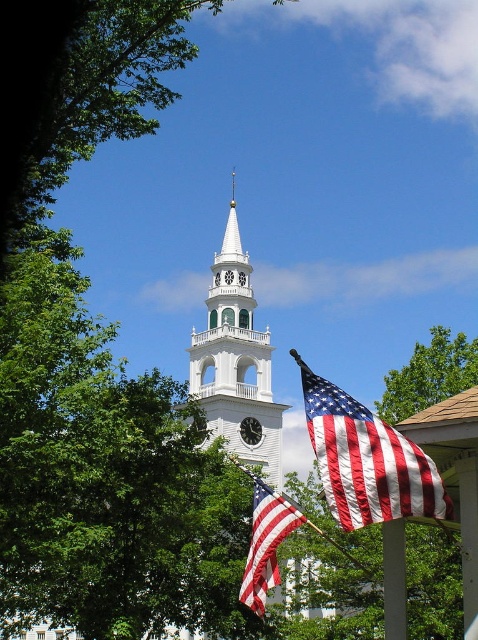
Is point (258, 356) positioned before point (260, 432)?

No, (258, 356) is behind (260, 432).

Between white wooden steeple at center and black metal clock at center, which one appears on the left side from the viewer's perspective?

Positioned to the left is white wooden steeple at center.

Image resolution: width=478 pixels, height=640 pixels. What do you see at coordinates (236, 358) in the screenshot?
I see `white wooden steeple at center` at bounding box center [236, 358].

The image size is (478, 640). Identify the location of white wooden steeple at center. (236, 358).

Based on the photo, is green leafy tree at lower right closer to camera compared to metallic flag pole at lower center?

No.

Does point (442, 378) lie in front of point (273, 552)?

No, it is not.

I want to click on green leafy tree at lower right, so click(x=428, y=374).

Is point (271, 540) less distant than point (249, 424)?

Yes, point (271, 540) is in front of point (249, 424).

Does american flag at lower center appear over black metal clock at center?

Actually, american flag at lower center is below black metal clock at center.

Is point (283, 504) in front of point (250, 422)?

Yes, it is.

I want to click on american flag at lower center, so click(x=265, y=541).